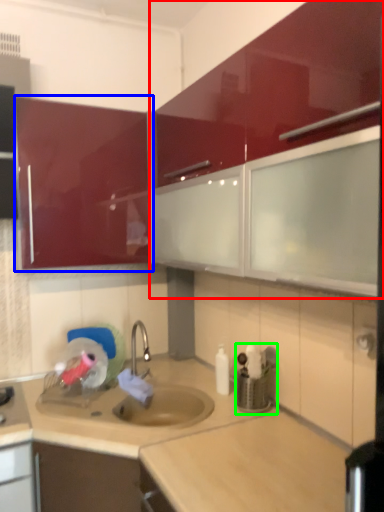
Question: Which is nearer to the cabinetry (highlighted by a red box)? cabinetry (highlighted by a blue box) or appliance (highlighted by a green box).

Choices:
 (A) cabinetry
 (B) appliance

Answer: (A)